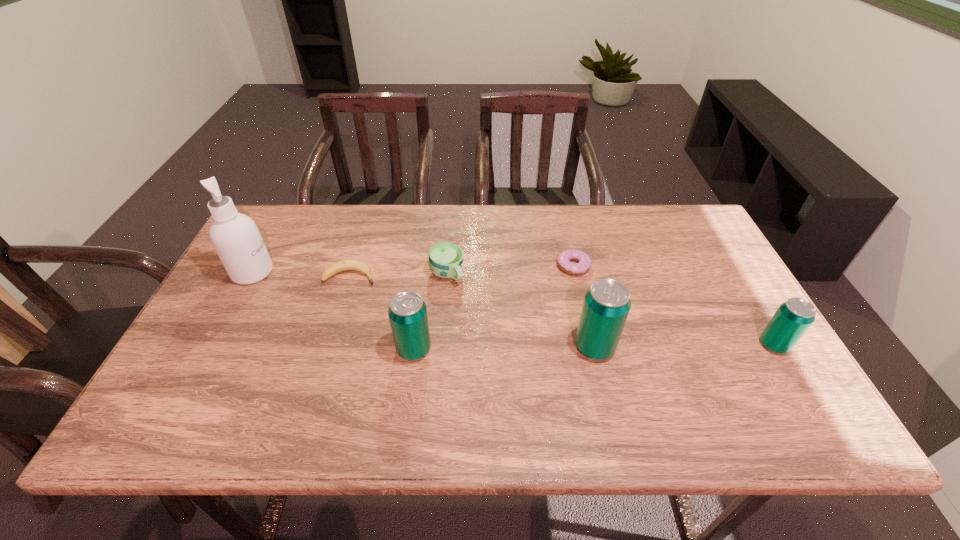
With all beer cans evenly spaced, where should an extra beer can be placed on the left to continue the pattern? Please point out a vacant space. Please provide its 2D coordinates. Your answer should be formatted as a tuple, i.e. [(x, y)], where the tuple contains the x and y coordinates of a point satisfying the conditions above.

[(231, 352)]